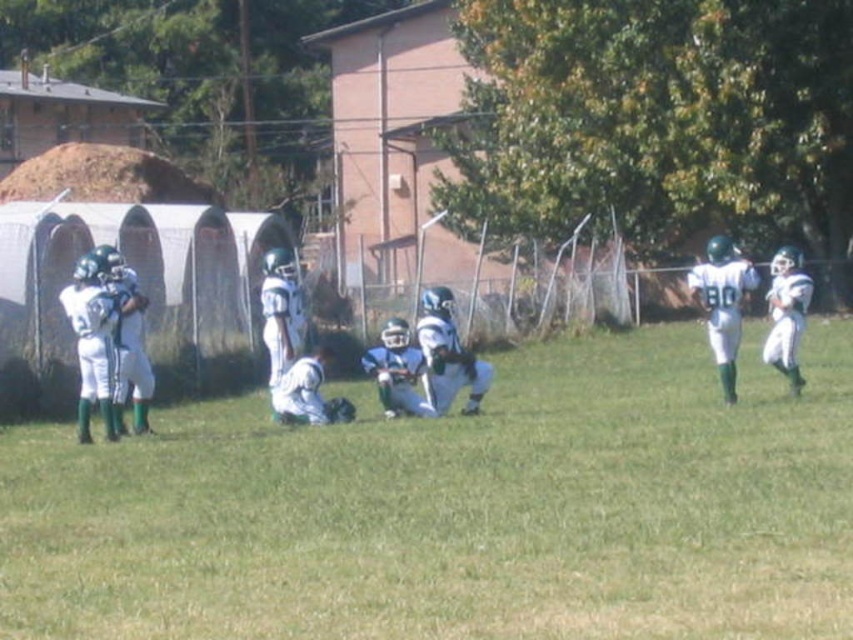
You are a photographer standing at the edge of the football field. You want to take a photo that includes both the white uniformed players at center and the pinkish building in the background. Based on their positions, is the pinkish building visible behind the players in the photo?

The white uniformed players at center are positioned at coordinates approximately 0.797 on the x and 0.536 on the y axis. Since the pinkish building is located behind them in the scene, it should be visible in the background of the photo as long as the camera angle captures both elements. However, the exact visibility may depend on the players not blocking the view entirely. The description does not specify if the players are directly in front of the building or offset, so assuming they are centered, the 0

You are a photographer standing at the edge of the football field. You want to take a photo that includes both the pinkish building with a sloped roof and the large pile of dirt or mulch to the left of it. However, you notice two points marked on your camera screen at coordinates point (734, 609) and point (740, 321). Which of these points is closer to you, the photographer?

The point at (734, 609) is closer to the photographer because it is closer to the viewer than point (740, 321).